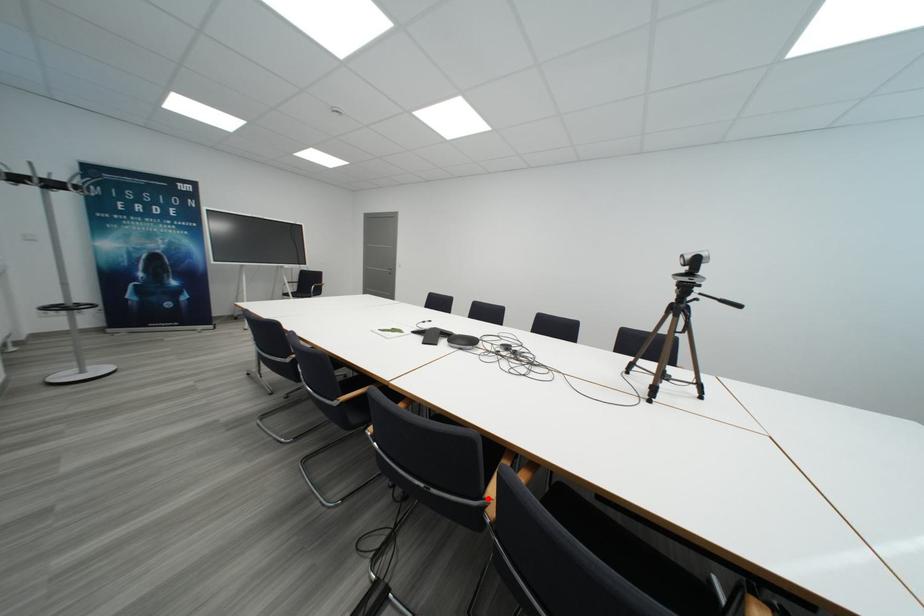
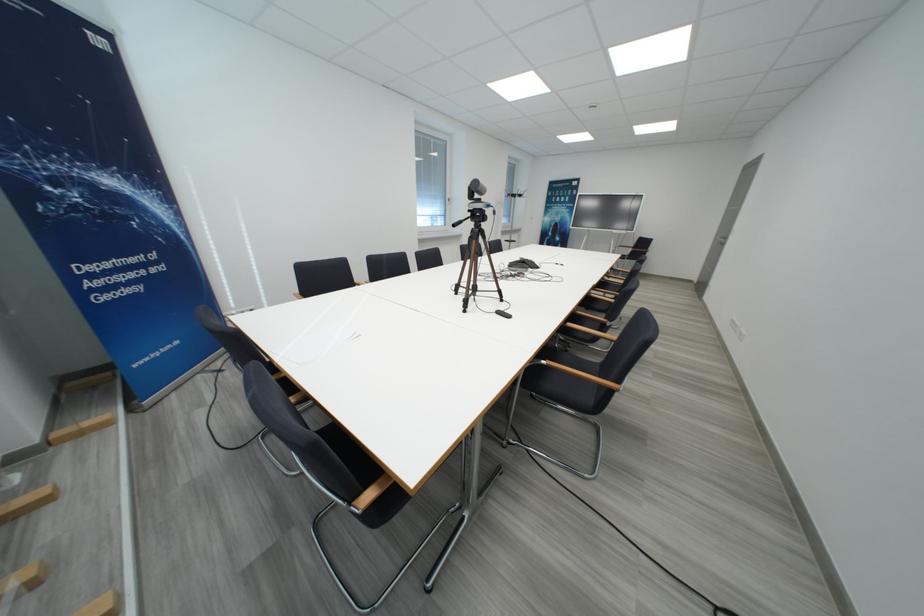
Question: I am providing you with two images of the same scene from different viewpoints. A red point is marked on the first image. At the location where the point appears in image 1, is it still visible in image 2?

Choices:
 (A) Yes
 (B) No

Answer: (B)